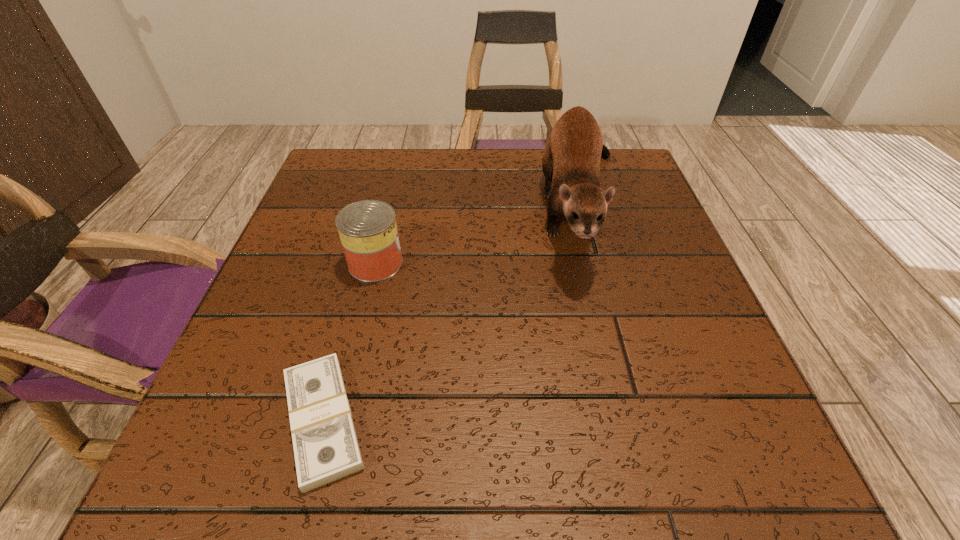
Where is `free space at the near left corner of the desktop`? free space at the near left corner of the desktop is located at coordinates (252, 480).

In the image, there is a desktop. Identify the location of vacant space at the far right corner. The height and width of the screenshot is (540, 960). (646, 193).

You are a GUI agent. You are given a task and a screenshot of the screen. Output one action in this format:
    pyautogui.click(x=<x>, y=<y>)
    Task: Click on the unoccupied position between the can and the dollar
    The width and height of the screenshot is (960, 540).
    Given the screenshot: What is the action you would take?
    pyautogui.click(x=349, y=342)

Where is `vacant space that's between the can and the dollar`? This screenshot has height=540, width=960. vacant space that's between the can and the dollar is located at coordinates (349, 342).

The image size is (960, 540). What are the coordinates of `free space between the ferret and the can` in the screenshot? It's located at (479, 235).

Where is `vacant space that's between the tallest object and the shortest object`? Image resolution: width=960 pixels, height=540 pixels. vacant space that's between the tallest object and the shortest object is located at coordinates (453, 314).

This screenshot has height=540, width=960. Find the location of `vacant space that is in between the nearest object and the tallest object`. vacant space that is in between the nearest object and the tallest object is located at coordinates (453, 314).

At what (x,y) coordinates should I click in order to perform the action: click on vacant area that lies between the tallest object and the dollar. Please return your answer as a coordinate pair (x, y). Looking at the image, I should click on (453, 314).

I want to click on vacant space that's between the can and the ferret, so click(479, 235).

At what (x,y) coordinates should I click in order to perform the action: click on vacant space that is in between the nearest object and the tallest object. Please return your answer as a coordinate pair (x, y). This screenshot has height=540, width=960. Looking at the image, I should click on (453, 314).